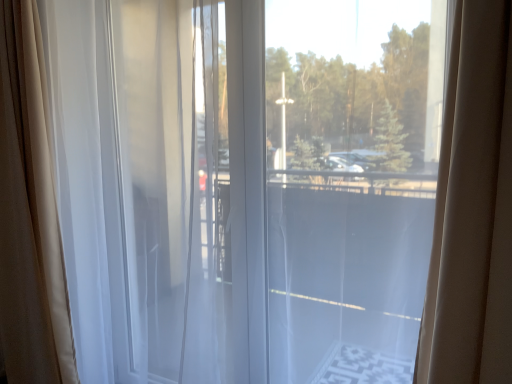
What is the approximate height of white sheer curtain at left, which appears as the first curtain when viewed from the right?

white sheer curtain at left, which appears as the first curtain when viewed from the right, is 6.32 feet tall.

The image size is (512, 384). Describe the element at coordinates (137, 184) in the screenshot. I see `white sheer curtain at left, which appears as the first curtain when viewed from the right` at that location.

What do you see at coordinates (29, 213) in the screenshot? I see `sheer white curtain at left, which ranks as the 1th curtain in left-to-right order` at bounding box center [29, 213].

I want to click on white sheer curtain at left, which appears as the first curtain when viewed from the right, so click(137, 184).

Does sheer white curtain at left, which ranks as the 1th curtain in left-to-right order, turn towards transparent glass window at center?

No, sheer white curtain at left, which ranks as the 1th curtain in left-to-right order, is not aimed at transparent glass window at center.

Between sheer white curtain at left, which ranks as the 1th curtain in left-to-right order, and transparent glass window at center, which one has smaller width?

Thinner between the two is transparent glass window at center.

Is sheer white curtain at left, which ranks as the 1th curtain in left-to-right order, at the right side of transparent glass window at center?

No, sheer white curtain at left, which ranks as the 1th curtain in left-to-right order, is not to the right of transparent glass window at center.

Between sheer white curtain at left, arranged as the 2th curtain when viewed from the right, and transparent glass window at center, which one is positioned behind?

sheer white curtain at left, arranged as the 2th curtain when viewed from the right.

Is transparent glass window at center not within sheer white curtain at left, arranged as the 2th curtain when viewed from the right?

Yes, transparent glass window at center is not within sheer white curtain at left, arranged as the 2th curtain when viewed from the right.

From the image's perspective, is transparent glass window at center above sheer white curtain at left, arranged as the 2th curtain when viewed from the right?

Correct, transparent glass window at center appears higher than sheer white curtain at left, arranged as the 2th curtain when viewed from the right, in the image.

Where is `curtain that is the 2nd one below the transparent glass window at center (from a real-world perspective)`? curtain that is the 2nd one below the transparent glass window at center (from a real-world perspective) is located at coordinates (29, 213).

Which object is wider, transparent glass window at center or sheer white curtain at left, arranged as the 2th curtain when viewed from the right?

sheer white curtain at left, arranged as the 2th curtain when viewed from the right, is wider.

I want to click on curtain to the right of sheer white curtain at left, arranged as the 2th curtain when viewed from the right, so click(137, 184).

Considering the sizes of objects sheer white curtain at left, which ranks as the 1th curtain in left-to-right order, and white sheer curtain at left, which appears as the first curtain when viewed from the right, in the image provided, who is bigger, sheer white curtain at left, which ranks as the 1th curtain in left-to-right order, or white sheer curtain at left, which appears as the first curtain when viewed from the right,?

Bigger between the two is white sheer curtain at left, which appears as the first curtain when viewed from the right.

Does sheer white curtain at left, arranged as the 2th curtain when viewed from the right, have a lesser width compared to white sheer curtain at left, the second curtain from the left?

In fact, sheer white curtain at left, arranged as the 2th curtain when viewed from the right, might be wider than white sheer curtain at left, the second curtain from the left.

Between point (21, 53) and point (74, 99), which one is positioned in front?

Positioned in front is point (74, 99).

From a real-world perspective, is white sheer curtain at left, which appears as the first curtain when viewed from the right, physically above sheer white curtain at left, arranged as the 2th curtain when viewed from the right?

Yes, from a real-world perspective, white sheer curtain at left, which appears as the first curtain when viewed from the right, is over sheer white curtain at left, arranged as the 2th curtain when viewed from the right

Is point (94, 215) positioned in front of point (53, 279)?

Yes, it is in front of point (53, 279).

Identify the location of curtain on the right of the sheer white curtain at left, arranged as the 2th curtain when viewed from the right. This screenshot has width=512, height=384. (137, 184).

At what (x,y) coordinates should I click in order to perform the action: click on glass window above the white sheer curtain at left, the second curtain from the left (from the image's perspective). Please return your answer as a coordinate pair (x, y). Image resolution: width=512 pixels, height=384 pixels. Looking at the image, I should click on pyautogui.click(x=351, y=184).

Is transparent glass window at center spatially inside white sheer curtain at left, which appears as the first curtain when viewed from the right, or outside of it?

transparent glass window at center exists outside the volume of white sheer curtain at left, which appears as the first curtain when viewed from the right.

Which of these two, transparent glass window at center or white sheer curtain at left, the second curtain from the left, is thinner?

Thinner between the two is white sheer curtain at left, the second curtain from the left.

Is white sheer curtain at left, which appears as the first curtain when viewed from the right, at the left side of transparent glass window at center?

Yes, white sheer curtain at left, which appears as the first curtain when viewed from the right, is to the left of transparent glass window at center.

You are a GUI agent. You are given a task and a screenshot of the screen. Output one action in this format:
    pyautogui.click(x=<x>, y=<y>)
    Task: Click on the curtain that is the 2nd one when counting downward from the transparent glass window at center (from the image's perspective)
    This screenshot has width=512, height=384.
    Given the screenshot: What is the action you would take?
    pyautogui.click(x=137, y=184)

Based on the photo, considering the relative sizes of white sheer curtain at left, which appears as the first curtain when viewed from the right, and transparent glass window at center in the image provided, is white sheer curtain at left, which appears as the first curtain when viewed from the right, bigger than transparent glass window at center?

Yes, white sheer curtain at left, which appears as the first curtain when viewed from the right, is bigger than transparent glass window at center.

Is white sheer curtain at left, which appears as the first curtain when viewed from the right, facing away from transparent glass window at center?

That's not correct — white sheer curtain at left, which appears as the first curtain when viewed from the right, is not looking away from transparent glass window at center.

Find the location of a particular element. The width and height of the screenshot is (512, 384). glass window above the sheer white curtain at left, which ranks as the 1th curtain in left-to-right order (from the image's perspective) is located at coordinates (351, 184).

I want to click on glass window above the sheer white curtain at left, arranged as the 2th curtain when viewed from the right (from a real-world perspective), so click(x=351, y=184).

Estimate the real-world distances between objects in this image. Which object is further from transparent glass window at center, white sheer curtain at left, which appears as the first curtain when viewed from the right, or sheer white curtain at left, which ranks as the 1th curtain in left-to-right order?

Based on the image, sheer white curtain at left, which ranks as the 1th curtain in left-to-right order, appears to be further to transparent glass window at center.

Estimate the real-world distances between objects in this image. Which object is closer to transparent glass window at center, sheer white curtain at left, which ranks as the 1th curtain in left-to-right order, or white sheer curtain at left, which appears as the first curtain when viewed from the right?

Based on the image, white sheer curtain at left, which appears as the first curtain when viewed from the right, appears to be nearer to transparent glass window at center.

From the image, which object appears to be farther from sheer white curtain at left, which ranks as the 1th curtain in left-to-right order, white sheer curtain at left, which appears as the first curtain when viewed from the right, or transparent glass window at center?

Based on the image, transparent glass window at center appears to be further to sheer white curtain at left, which ranks as the 1th curtain in left-to-right order.

Estimate the real-world distances between objects in this image. Which object is further from white sheer curtain at left, the second curtain from the left, transparent glass window at center or sheer white curtain at left, which ranks as the 1th curtain in left-to-right order?

transparent glass window at center is further to white sheer curtain at left, the second curtain from the left.

Based on their spatial positions, is sheer white curtain at left, which ranks as the 1th curtain in left-to-right order, or transparent glass window at center further from white sheer curtain at left, which appears as the first curtain when viewed from the right?

Among the two, transparent glass window at center is located further to white sheer curtain at left, which appears as the first curtain when viewed from the right.

Which object lies nearer to the anchor point sheer white curtain at left, arranged as the 2th curtain when viewed from the right, transparent glass window at center or white sheer curtain at left, which appears as the first curtain when viewed from the right?

white sheer curtain at left, which appears as the first curtain when viewed from the right, is closer to sheer white curtain at left, arranged as the 2th curtain when viewed from the right.

This screenshot has height=384, width=512. I want to click on curtain situated between sheer white curtain at left, which ranks as the 1th curtain in left-to-right order, and transparent glass window at center from left to right, so click(137, 184).